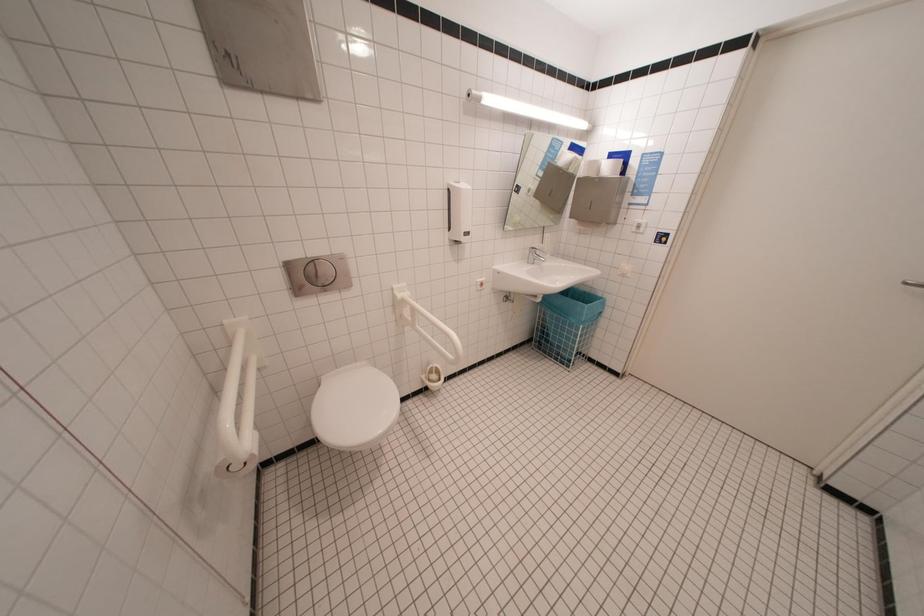
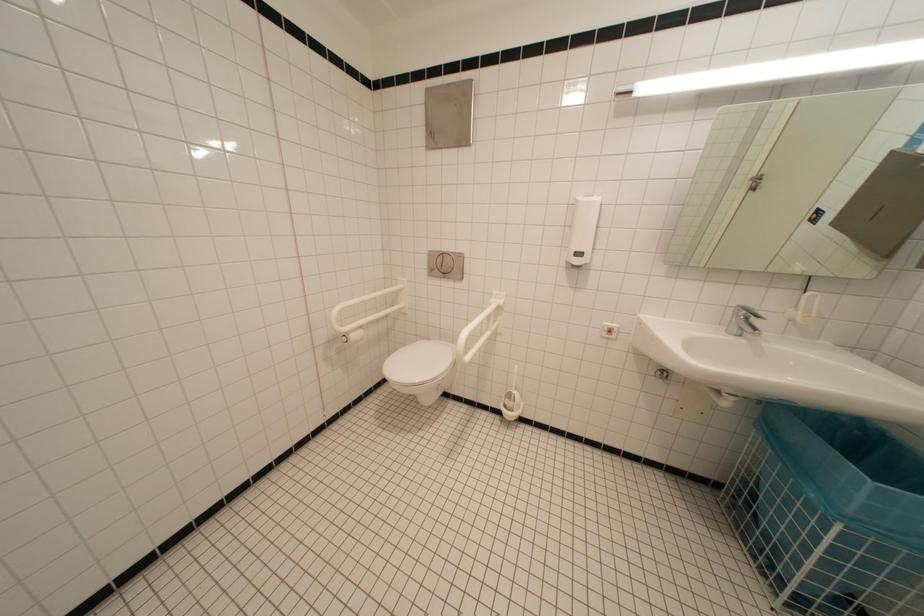
Question: The camera is either moving clockwise (left) or counter-clockwise (right) around the object. The first image is from the beginning of the video and the second image is from the end. Is the camera moving left or right when shooting the video?

Choices:
 (A) Left
 (B) Right

Answer: (B)